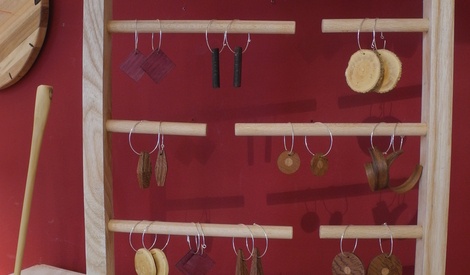
Locate an element on the screen. This screenshot has width=470, height=275. clock is located at coordinates (x=13, y=34).